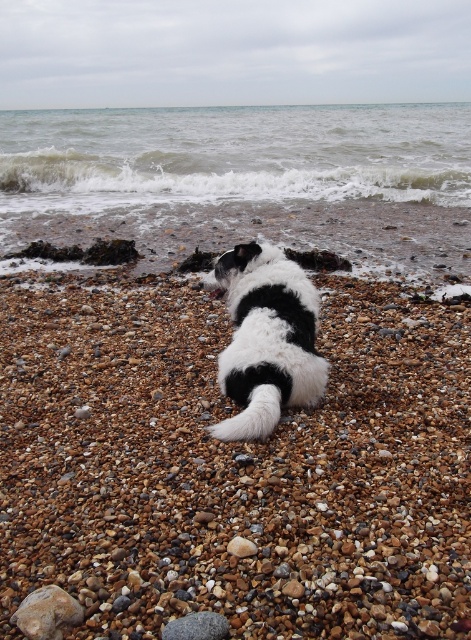
Question: Among these points, which one is farthest from the camera?

Choices:
 (A) (169, 417)
 (B) (189, 138)
 (C) (183, 624)
 (D) (300, 323)

Answer: (B)

Question: Does grayish-blue water at upper center appear over gray smooth rock at center?

Choices:
 (A) yes
 (B) no

Answer: (A)

Question: Can you confirm if smooth pebble at center is positioned to the left of gray smooth rock at center?

Choices:
 (A) yes
 (B) no

Answer: (B)

Question: Which of the following is the closest to the observer?

Choices:
 (A) (64, 528)
 (B) (199, 614)

Answer: (B)

Question: Which point is closer to the camera?

Choices:
 (A) smooth pebble at center
 (B) grayish-blue water at upper center
 (C) gray smooth rock at center
 (D) black and white fur dog at center

Answer: (C)

Question: In this image, where is smooth pebble at center located relative to black and white fur dog at center?

Choices:
 (A) right
 (B) left

Answer: (A)